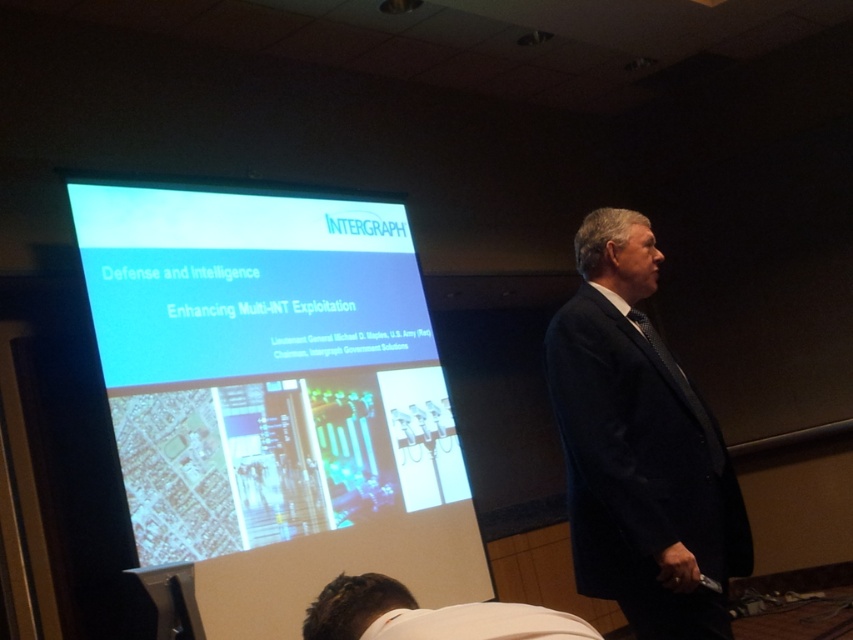
Locate an element on the screen. The width and height of the screenshot is (853, 640). black suit at center is located at coordinates (639, 448).

Does black suit at center come in front of white fabric shirt at lower center?

No, it is behind white fabric shirt at lower center.

Who is more distant from viewer, (584, 481) or (317, 620)?

The point (584, 481) is more distant.

Identify the location of black suit at center. (639, 448).

Is white glossy projector screen at upper center shorter than white fabric shirt at lower center?

No.

Can you confirm if white glossy projector screen at upper center is positioned above white fabric shirt at lower center?

Yes, white glossy projector screen at upper center is above white fabric shirt at lower center.

Is point (374, 212) behind point (370, 573)?

Yes, point (374, 212) is farther from viewer.

The width and height of the screenshot is (853, 640). In order to click on white glossy projector screen at upper center in this screenshot , I will do `click(273, 401)`.

Who is positioned more to the left, white glossy projector screen at upper center or black suit at center?

From the viewer's perspective, white glossy projector screen at upper center appears more on the left side.

Is point (309, 483) in front of point (573, 298)?

No, it is not.

Locate an element on the screen. The height and width of the screenshot is (640, 853). white glossy projector screen at upper center is located at coordinates (273, 401).